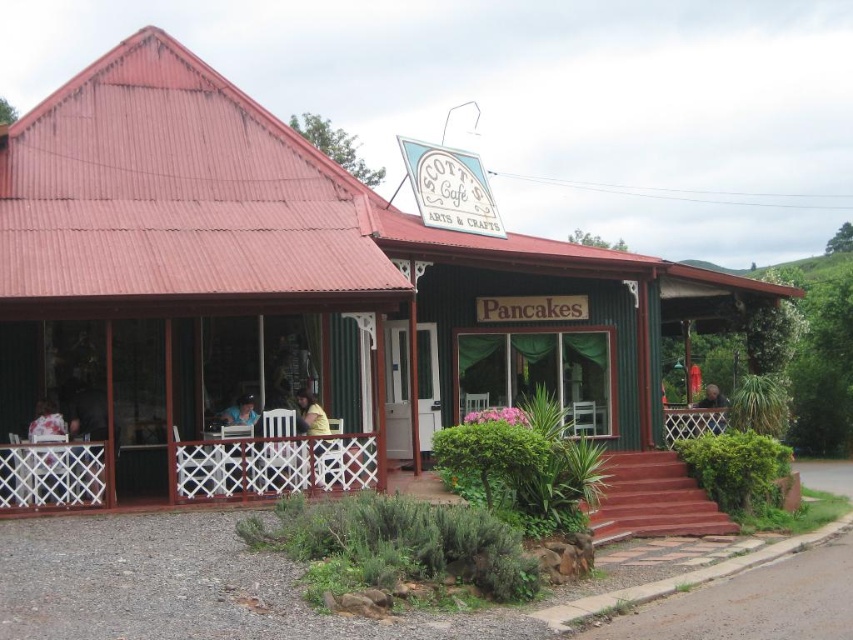
You are a customer standing at the entrance of Scotts Cafe and you see both the green wooden hut at center and the yellow fabric shirt at center. Which object is taller?

The green wooden hut at center is much taller than the yellow fabric shirt at center.

You are standing at the entrance of Scotts Cafe and want to place a decorative vase on the white lace tablecloth at lower left. According to the coordinates provided, where exactly should you place the vase?

The white lace tablecloth at lower left is located at point (49, 474), so you should place the vase there.

You are a customer standing at the entrance of Scotts Cafe and you see the green wooden hut at center and the yellow fabric shirt at center. Which object is wider?

The green wooden hut at center is wider than the yellow fabric shirt at center.